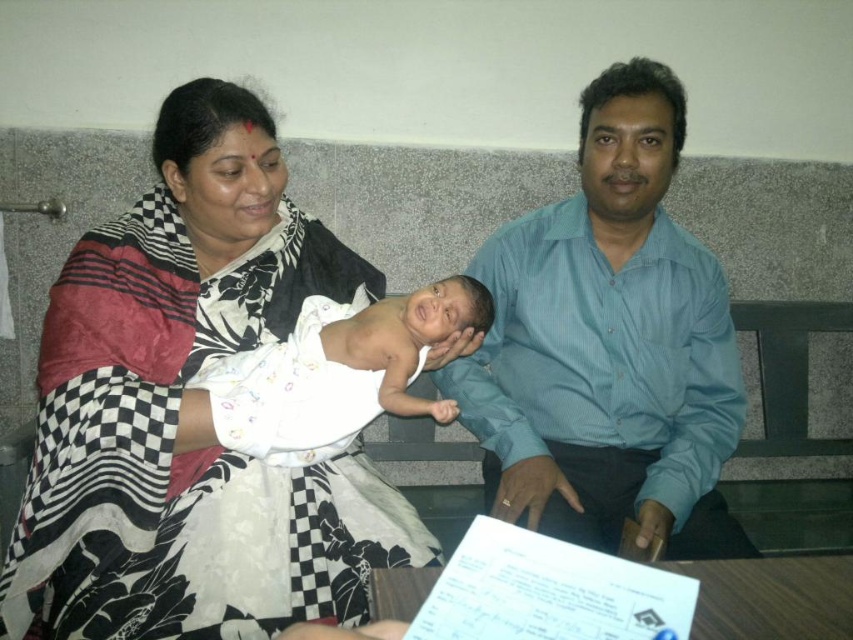
Question: Is black checkered saree at upper left below white clothed newborn at center?

Choices:
 (A) yes
 (B) no

Answer: (A)

Question: Is black checkered saree at upper left to the right of white clothed newborn at center from the viewer's perspective?

Choices:
 (A) no
 (B) yes

Answer: (A)

Question: Among these objects, which one is farthest from the camera?

Choices:
 (A) black checkered saree at upper left
 (B) white clothed newborn at center
 (C) blue striped shirt at center

Answer: (C)

Question: Which of the following is the closest to the observer?

Choices:
 (A) black checkered saree at upper left
 (B) blue striped shirt at center
 (C) white clothed newborn at center

Answer: (A)

Question: Can you confirm if blue striped shirt at center is bigger than white clothed newborn at center?

Choices:
 (A) no
 (B) yes

Answer: (B)

Question: Estimate the real-world distances between objects in this image. Which object is farther from the white clothed newborn at center?

Choices:
 (A) black checkered saree at upper left
 (B) blue striped shirt at center

Answer: (B)